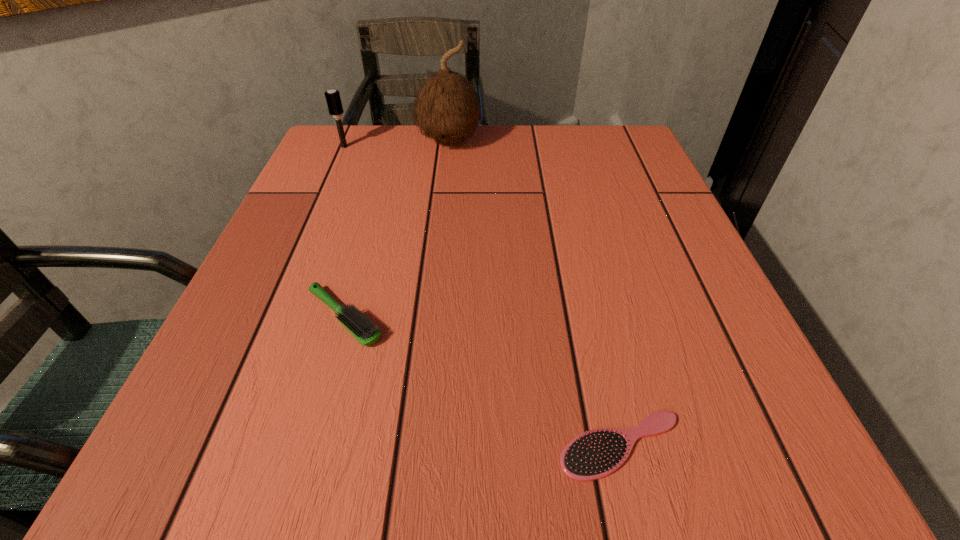
Locate an element on the screen. This screenshot has width=960, height=540. the tallest object is located at coordinates (447, 110).

Find the location of a particular element. the third shortest object is located at coordinates (333, 98).

Identify the location of the leftmost object. Image resolution: width=960 pixels, height=540 pixels. (333, 98).

You are a GUI agent. You are given a task and a screenshot of the screen. Output one action in this format:
    pyautogui.click(x=<x>, y=<y>)
    Task: Click on the second hairbrush from right to left
    
    Given the screenshot: What is the action you would take?
    pyautogui.click(x=366, y=333)

This screenshot has width=960, height=540. Identify the location of the second nearest hairbrush. (366, 333).

Where is `the nearest hairbrush`? The height and width of the screenshot is (540, 960). the nearest hairbrush is located at coordinates 593,455.

I want to click on the shortest hairbrush, so click(x=593, y=455).

At what (x,y) coordinates should I click in order to perform the action: click on vacant region located on the surface of the coconut. Please return your answer as a coordinate pair (x, y). This screenshot has width=960, height=540. Looking at the image, I should click on (440, 231).

The height and width of the screenshot is (540, 960). I want to click on vacant area situated 0.400m on the front of the tallest hairbrush, so click(291, 268).

This screenshot has height=540, width=960. Identify the location of blank space located on the back of the second shortest object. (371, 224).